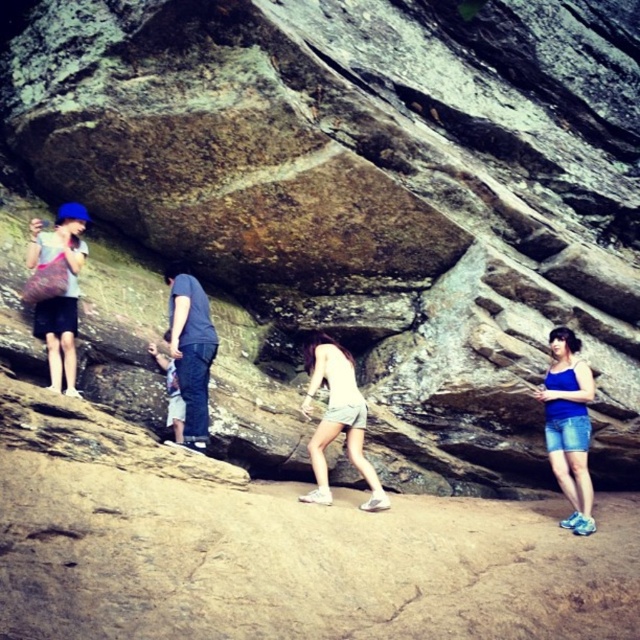
Question: Which object is positioned closest to the matte blue hat at left?

Choices:
 (A) blue denim shorts at lower right
 (B) dark blue jeans at center

Answer: (B)

Question: Is matte blue hat at left further to camera compared to dark blue jeans at center?

Choices:
 (A) yes
 (B) no

Answer: (A)

Question: Which object appears farthest from the camera in this image?

Choices:
 (A) matte blue hat at left
 (B) blue denim shorts at lower right
 (C) dark blue jeans at center

Answer: (B)

Question: Is the position of matte blue hat at left more distant than that of dark blue jeans at center?

Choices:
 (A) yes
 (B) no

Answer: (A)

Question: Is blue denim shorts at lower right bigger than dark blue jeans at center?

Choices:
 (A) yes
 (B) no

Answer: (A)

Question: Estimate the real-world distances between objects in this image. Which object is closer to the dark blue jeans at center?

Choices:
 (A) blue denim shorts at lower right
 (B) matte blue hat at left

Answer: (B)